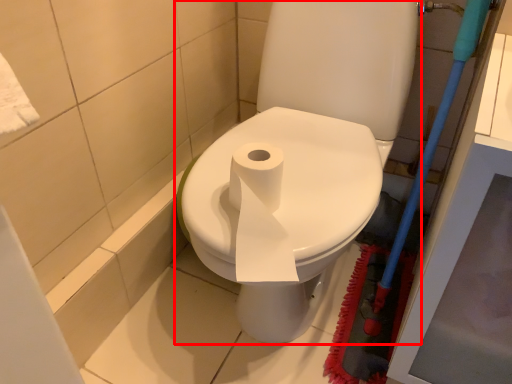
Question: From the image's perspective, considering the relative positions of toilet (annotated by the red box) and brush in the image provided, where is toilet (annotated by the red box) located with respect to the staircase?

Choices:
 (A) above
 (B) below

Answer: (A)